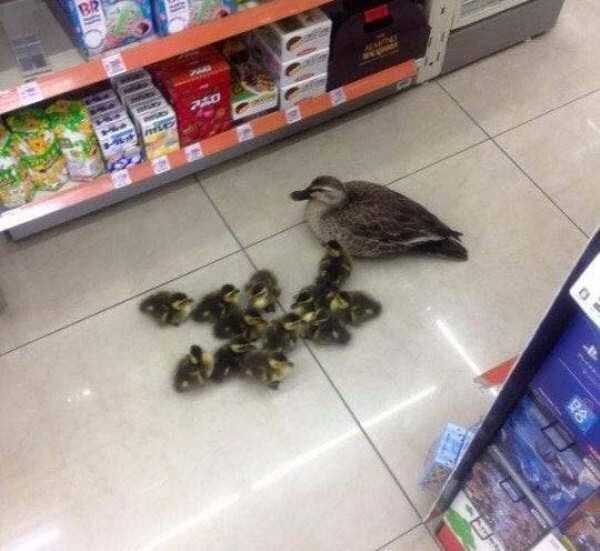
Identify the location of tile. (172, 244).